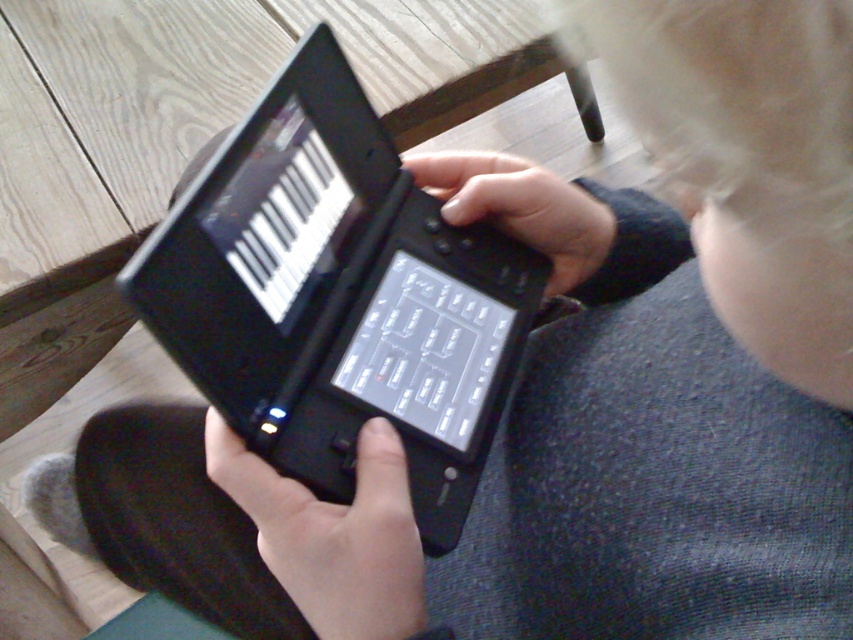
Question: Does black matte button at center appear under black matte hand at center?

Choices:
 (A) yes
 (B) no

Answer: (A)

Question: Considering the real-world distances, which object is farthest from the black matte button at center?

Choices:
 (A) black matte laptop at center
 (B) black matte hand at center

Answer: (B)

Question: Which point is closer to the camera taking this photo?

Choices:
 (A) (328, 579)
 (B) (250, 269)

Answer: (A)

Question: Among these points, which one is farthest from the camera?

Choices:
 (A) (386, 570)
 (B) (440, 364)
 (C) (421, 163)

Answer: (C)

Question: Is black matte button at center thinner than black matte hand at center?

Choices:
 (A) no
 (B) yes

Answer: (B)

Question: Is black matte button at center in front of black matte hand at center?

Choices:
 (A) no
 (B) yes

Answer: (B)